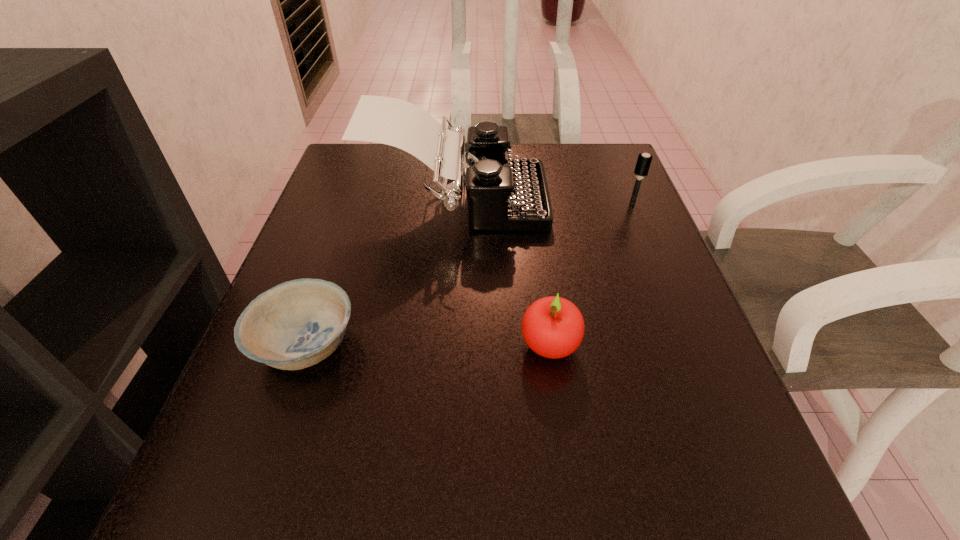
In order to click on empty space between the apple and the typewriter in this screenshot , I will do `click(504, 273)`.

The image size is (960, 540). Find the location of `free spot between the apple and the tallest object`. free spot between the apple and the tallest object is located at coordinates (504, 273).

This screenshot has width=960, height=540. What are the coordinates of `vacant area that lies between the bowl and the hairbrush` in the screenshot? It's located at (469, 273).

Identify the location of empty location between the rightmost object and the apple. (590, 274).

Locate an element on the screen. The image size is (960, 540). unoccupied area between the apple and the bowl is located at coordinates (427, 344).

At what (x,y) coordinates should I click in order to perform the action: click on free spot between the apple and the tallest object. Please return your answer as a coordinate pair (x, y). Looking at the image, I should click on (504, 273).

Image resolution: width=960 pixels, height=540 pixels. Find the location of `empty space between the hairbrush and the bowl`. empty space between the hairbrush and the bowl is located at coordinates (469, 273).

Find the location of a particular element. The height and width of the screenshot is (540, 960). empty location between the hairbrush and the bowl is located at coordinates (469, 273).

At what (x,y) coordinates should I click in order to perform the action: click on blank region between the typewriter and the bowl. Please return your answer as a coordinate pair (x, y). Looking at the image, I should click on (382, 273).

Select which object is the third closest to the bowl. Please provide its 2D coordinates. Your answer should be formatted as a tuple, i.e. [(x, y)], where the tuple contains the x and y coordinates of a point satisfying the conditions above.

[(644, 160)]